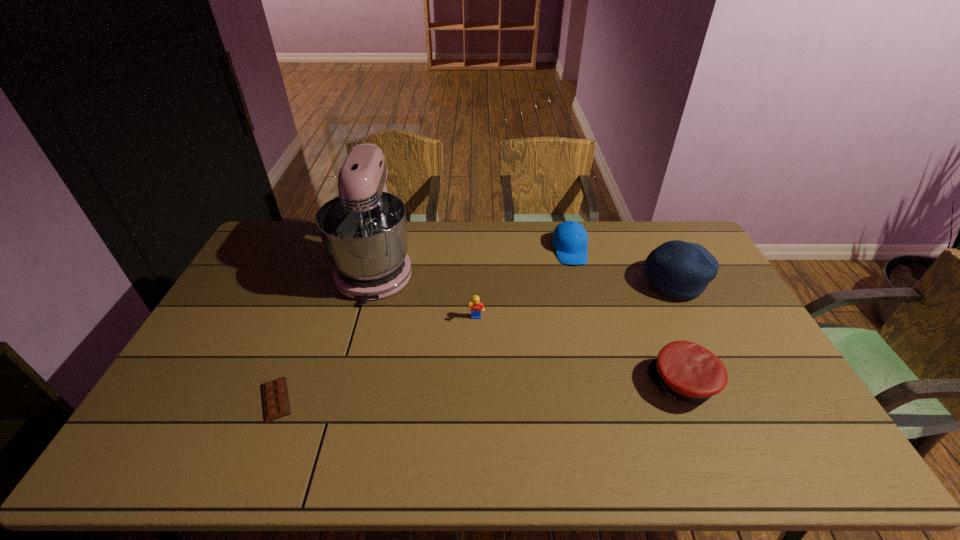
This screenshot has width=960, height=540. Find the location of `free area in between the nearer cap and the left cap`. free area in between the nearer cap and the left cap is located at coordinates (627, 316).

Locate an element on the screen. free space between the nearer cap and the tallest object is located at coordinates (530, 326).

Locate an element on the screen. This screenshot has width=960, height=540. free point between the right cap and the farther cap is located at coordinates (627, 316).

You are a GUI agent. You are given a task and a screenshot of the screen. Output one action in this format:
    pyautogui.click(x=<x>, y=<y>)
    Task: Click on the closest object to the shortest object
    
    Given the screenshot: What is the action you would take?
    pyautogui.click(x=364, y=233)

The height and width of the screenshot is (540, 960). What are the coordinates of `object that stands as the third closest to the fifth shortest object` in the screenshot? It's located at (477, 307).